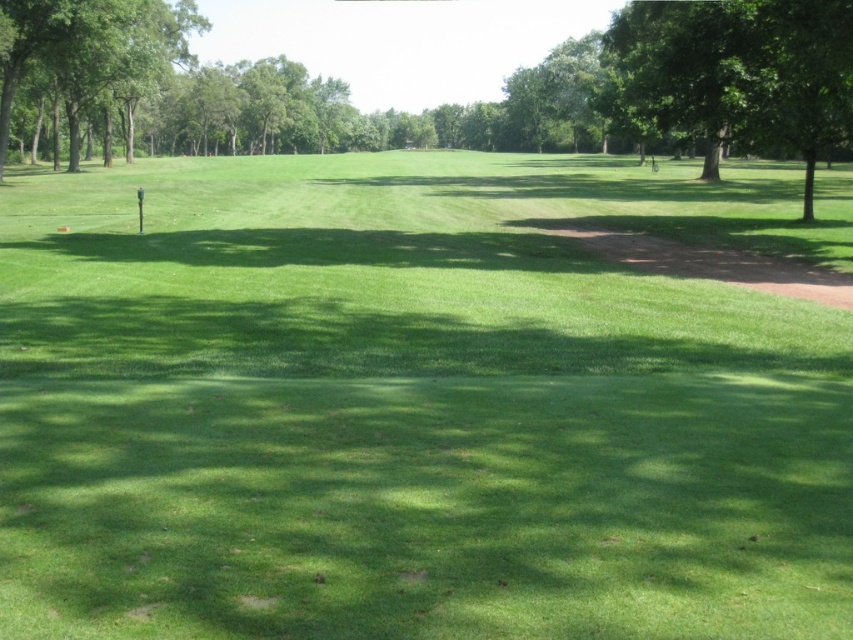
Question: Is green leafy tree at upper right to the left of green leafy tree at upper left from the viewer's perspective?

Choices:
 (A) no
 (B) yes

Answer: (A)

Question: Is green leafy tree at upper right to the left of green leafy tree at upper left from the viewer's perspective?

Choices:
 (A) yes
 (B) no

Answer: (B)

Question: Which of the following is the closest to the observer?

Choices:
 (A) (38, 48)
 (B) (651, 100)

Answer: (B)

Question: Which point is farther from the camera taking this photo?

Choices:
 (A) (706, 122)
 (B) (155, 61)

Answer: (B)

Question: Is green leafy tree at upper right below green leafy tree at upper left?

Choices:
 (A) no
 (B) yes

Answer: (B)

Question: Which point appears closest to the camera in this image?

Choices:
 (A) (706, 112)
 (B) (114, 58)

Answer: (A)